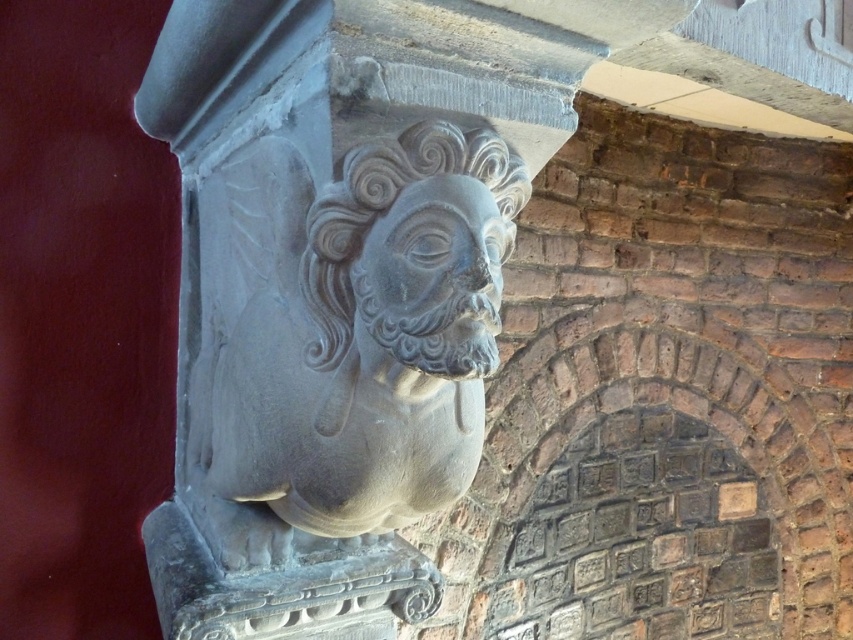
You are an art conservator assessing the structural integrity of the gray stone head at center and the gray stone bust at center. Based on their widths, which one is more likely to require reinforcement to prevent damage from wind erosion?

The gray stone head at center has a larger width than the gray stone bust at center, making it more susceptible to wind erosion and thus more likely to require reinforcement.

What object is located at the coordinates point [358,326] in the image?

The point [358,326] marks the gray stone bust at center.

Consider the image. You are an art conservator examining the stone details on a historical building. You notice two objects, the gray stone head at center and the gray stone bust at center. Which one is bigger?

The gray stone head at center is larger than the gray stone bust at center.